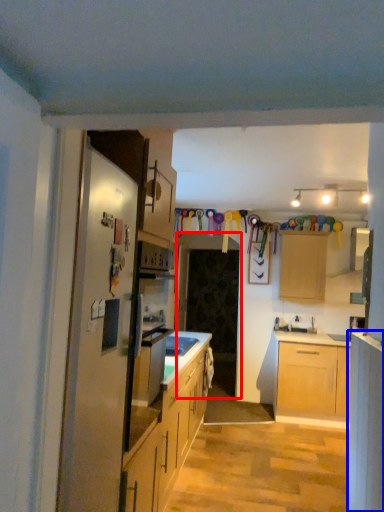
Question: Which point is further to the camera, glass door (highlighted by a red box) or cabinetry (highlighted by a blue box)?

Choices:
 (A) glass door
 (B) cabinetry

Answer: (A)